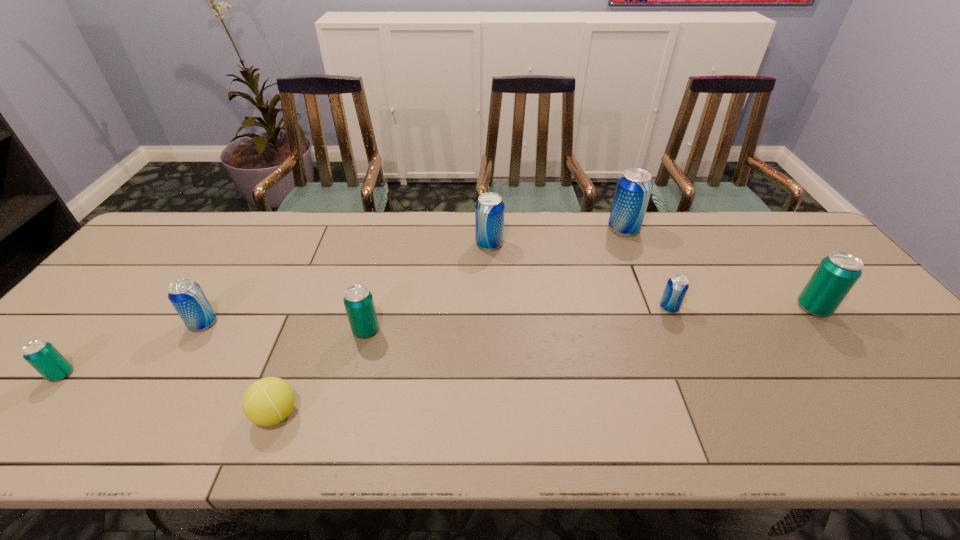
Where is `beer can that is the fourth closest to the second farthest teal beer can`? Image resolution: width=960 pixels, height=540 pixels. beer can that is the fourth closest to the second farthest teal beer can is located at coordinates (677, 286).

Locate which beer can is the third closest to the second beer can from left to right. Please provide its 2D coordinates. Your answer should be formatted as a tuple, i.e. [(x, y)], where the tuple contains the x and y coordinates of a point satisfying the conditions above.

[(489, 209)]

Find the location of a particular element. This screenshot has height=540, width=960. blue beer can that is the second closest one to the tallest beer can is located at coordinates (489, 209).

Locate which blue beer can is the second closest to the smallest blue beer can. Please provide its 2D coordinates. Your answer should be formatted as a tuple, i.e. [(x, y)], where the tuple contains the x and y coordinates of a point satisfying the conditions above.

[(489, 209)]

Where is `the closest teal beer can to the leftmost beer can`? This screenshot has width=960, height=540. the closest teal beer can to the leftmost beer can is located at coordinates (358, 300).

Identify which teal beer can is the second closest to the leftmost teal beer can. Please provide its 2D coordinates. Your answer should be formatted as a tuple, i.e. [(x, y)], where the tuple contains the x and y coordinates of a point satisfying the conditions above.

[(835, 276)]